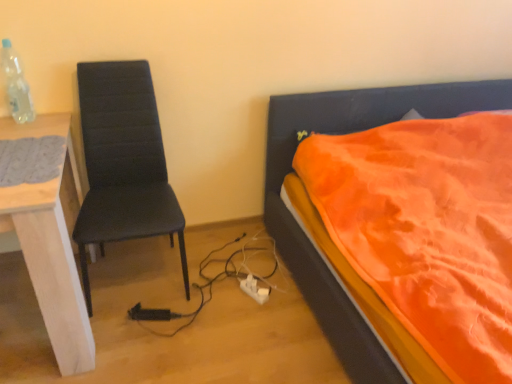
Question: From the image's perspective, is white wood desk at left over orange fabric bed at right?

Choices:
 (A) no
 (B) yes

Answer: (A)

Question: Is white wood desk at left positioned with its back to orange fabric bed at right?

Choices:
 (A) yes
 (B) no

Answer: (B)

Question: Is white wood desk at left surrounding orange fabric bed at right?

Choices:
 (A) no
 (B) yes

Answer: (A)

Question: From a real-world perspective, is white wood desk at left below orange fabric bed at right?

Choices:
 (A) yes
 (B) no

Answer: (A)

Question: Does white wood desk at left appear on the right side of orange fabric bed at right?

Choices:
 (A) no
 (B) yes

Answer: (A)

Question: Is white wood desk at left shorter than orange fabric bed at right?

Choices:
 (A) no
 (B) yes

Answer: (B)

Question: Is white plastic power plugs and sockets at lower center at the left side of matte black chair at left?

Choices:
 (A) no
 (B) yes

Answer: (A)

Question: Can you confirm if white plastic power plugs and sockets at lower center is positioned to the right of matte black chair at left?

Choices:
 (A) yes
 (B) no

Answer: (A)

Question: Considering the relative sizes of white plastic power plugs and sockets at lower center and matte black chair at left in the image provided, is white plastic power plugs and sockets at lower center taller than matte black chair at left?

Choices:
 (A) yes
 (B) no

Answer: (B)

Question: Is white plastic power plugs and sockets at lower center turned away from matte black chair at left?

Choices:
 (A) yes
 (B) no

Answer: (B)

Question: Can you see white plastic power plugs and sockets at lower center touching matte black chair at left?

Choices:
 (A) yes
 (B) no

Answer: (B)

Question: Does white plastic power plugs and sockets at lower center lie in front of matte black chair at left?

Choices:
 (A) yes
 (B) no

Answer: (B)

Question: Is matte black chair at left closer to camera compared to gray knitted mat at left?

Choices:
 (A) yes
 (B) no

Answer: (B)